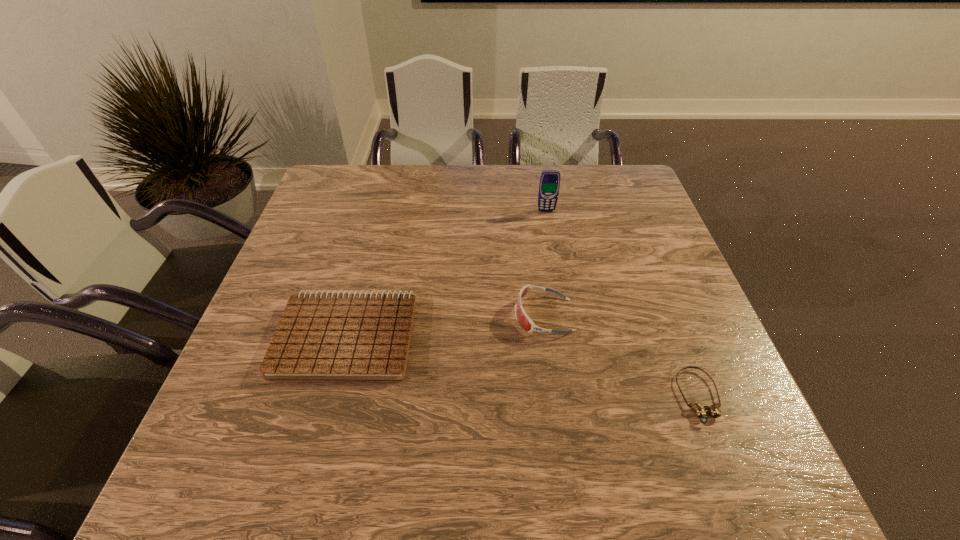
Identify the location of vacant space at the far left corner of the desktop. tap(355, 181).

The image size is (960, 540). What are the coordinates of `free space between the farther goggles and the shortest object` in the screenshot? It's located at (621, 356).

Locate an element on the screen. The width and height of the screenshot is (960, 540). vacant area between the cellular telephone and the right goggles is located at coordinates (622, 303).

In order to click on free space between the tallest object and the shorter goggles in this screenshot , I will do `click(622, 303)`.

This screenshot has width=960, height=540. Identify the location of vacant region between the rightmost object and the farthest object. (622, 303).

Find the location of a particular element. vacant region between the rightmost object and the cellular telephone is located at coordinates (622, 303).

Where is `free space between the notebook and the shortest object`? The image size is (960, 540). free space between the notebook and the shortest object is located at coordinates (522, 366).

The width and height of the screenshot is (960, 540). In order to click on empty location between the leftmost object and the farthest object in this screenshot , I will do `click(446, 273)`.

Where is `vacant space that's between the shorter goggles and the leftmost object`? The height and width of the screenshot is (540, 960). vacant space that's between the shorter goggles and the leftmost object is located at coordinates (522, 366).

The image size is (960, 540). Identify the location of empty location between the leftmost object and the shortest object. (522, 366).